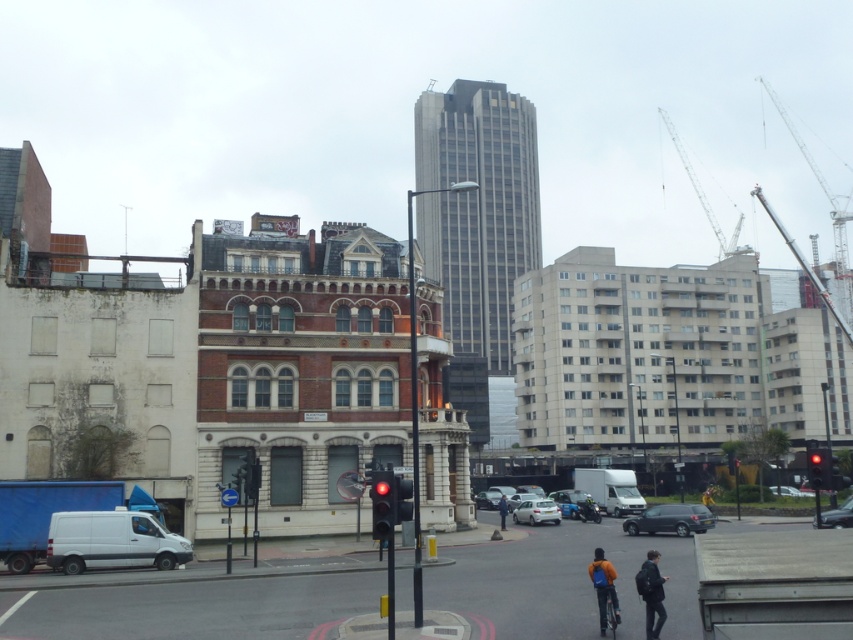
Consider the image. You are a delivery person who needs to place a package on the blue leather jacket at center and the metallic silver car at center. Which object is closer to the left side of the street?

The blue leather jacket at center is positioned on the left side of the metallic silver car at center, so it is closer to the left side of the street.

You are standing at the intersection and need to determine which point is closer to you. The points are labeled as point 1 at coordinates (596, 512) and point 2 at (503, 522). Which point is closer to your current position?

Point 2 at (503, 522) is closer to you because it is less further away than point 1 at (596, 512) according to the description.

You are a delivery person who needs to place a new package on the blue leather jacket at center and the metallic silver car at center. Which object can you place the package on without it falling off?

The metallic silver car at center is wider than the blue leather jacket at center, so placing the package on the metallic silver car at center would be more stable and less likely to fall off.